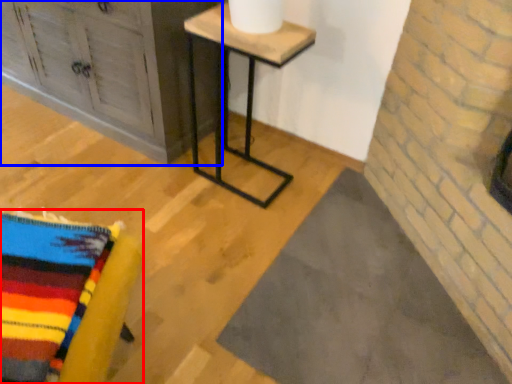
Question: Which point is closer to the camera, furniture (highlighted by a red box) or furniture (highlighted by a blue box)?

Choices:
 (A) furniture
 (B) furniture

Answer: (A)